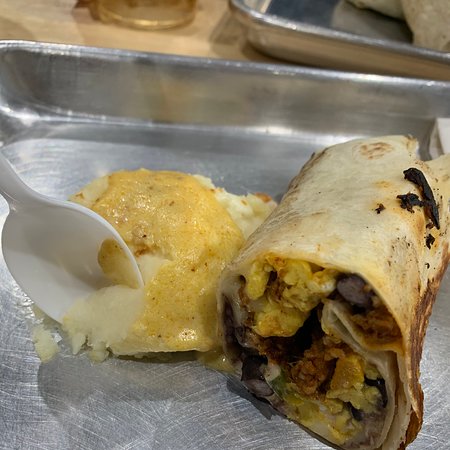
Locate an element on the screen. This screenshot has width=450, height=450. spoon is located at coordinates (25, 243).